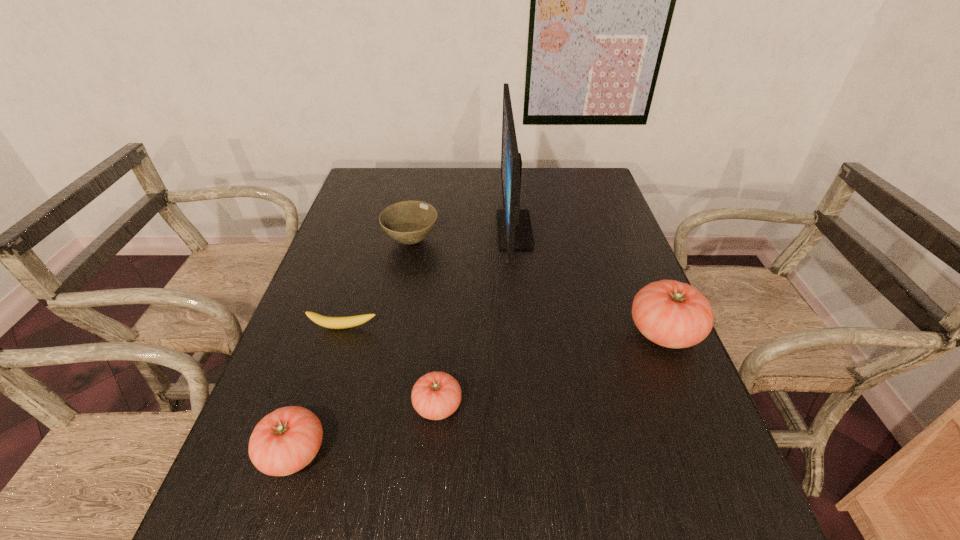
You are a GUI agent. You are given a task and a screenshot of the screen. Output one action in this format:
    pyautogui.click(x=<x>, y=<y>)
    Task: Click on the free space between the shortest tomato and the leftmost tomato
    
    Given the screenshot: What is the action you would take?
    pyautogui.click(x=366, y=429)

Identify the location of vacant space that is in between the shortest tomato and the tallest object. (476, 318).

Where is `empty space between the second object from right to left and the second shortest tomato`? The image size is (960, 540). empty space between the second object from right to left and the second shortest tomato is located at coordinates (404, 341).

Find the location of a particular element. free space that is in between the tallest object and the second tallest object is located at coordinates (589, 281).

The width and height of the screenshot is (960, 540). What are the coordinates of `vacant space that is in between the second tallest tomato and the rightmost tomato` in the screenshot? It's located at (479, 392).

At what (x,y) coordinates should I click in order to perform the action: click on vacant area that lies between the banana and the tallest object. Please return your answer as a coordinate pair (x, y). The width and height of the screenshot is (960, 540). Looking at the image, I should click on pos(429,278).

Locate an element on the screen. The height and width of the screenshot is (540, 960). free space between the shortest object and the tallest object is located at coordinates (429, 278).

What are the coordinates of `free spot between the banana and the tallest object` in the screenshot? It's located at (429, 278).

Find the location of `free space between the shortest tomato and the second tallest tomato`. free space between the shortest tomato and the second tallest tomato is located at coordinates (366, 429).

Select which object is the closest to the farthest tomato. Please provide its 2D coordinates. Your answer should be formatted as a tuple, i.e. [(x, y)], where the tuple contains the x and y coordinates of a point satisfying the conditions above.

[(514, 229)]